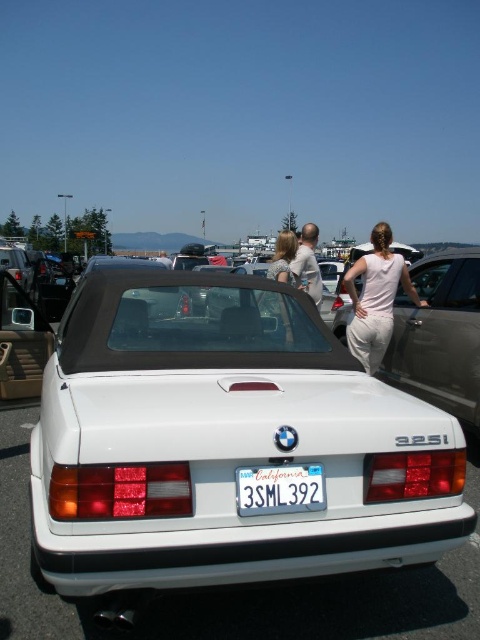
Does white plastic license plate at center have a greater width compared to light beige fabric shirt at center?

In fact, white plastic license plate at center might be narrower than light beige fabric shirt at center.

Which of these two, white plastic license plate at center or light beige fabric shirt at center, stands shorter?

Standing shorter between the two is white plastic license plate at center.

Does point (297, 467) come farther from viewer compared to point (300, 234)?

No, (297, 467) is closer to viewer.

Where is `white plastic license plate at center`? This screenshot has height=640, width=480. white plastic license plate at center is located at coordinates (279, 490).

Does white matte sedan at center have a smaller size compared to white cotton shirt at center?

Actually, white matte sedan at center might be larger than white cotton shirt at center.

Between point (218, 442) and point (347, 333), which one is positioned behind?

Positioned behind is point (347, 333).

Is point (304, 518) closer to camera compared to point (357, 340)?

Yes, point (304, 518) is in front of point (357, 340).

The width and height of the screenshot is (480, 640). Find the location of `white matte sedan at center`. white matte sedan at center is located at coordinates (225, 442).

Can you confirm if white plastic license plate at center is positioned above matte beige dress at center?

No, white plastic license plate at center is not above matte beige dress at center.

Between white plastic license plate at center and matte beige dress at center, which one has more height?

matte beige dress at center

What do you see at coordinates (279, 490) in the screenshot? I see `white plastic license plate at center` at bounding box center [279, 490].

You are a GUI agent. You are given a task and a screenshot of the screen. Output one action in this format:
    pyautogui.click(x=<x>, y=<y>)
    Task: Click on the white plastic license plate at center
    
    Given the screenshot: What is the action you would take?
    pyautogui.click(x=279, y=490)